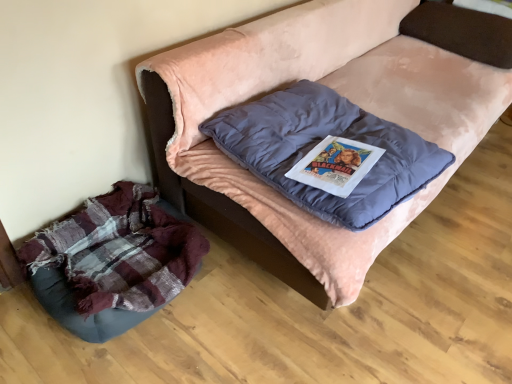
Image resolution: width=512 pixels, height=384 pixels. Describe the element at coordinates (462, 31) in the screenshot. I see `velvet blue pillow at upper right, the 1th pillow when ordered from top to bottom` at that location.

Locate an element on the screen. plaid fabric dog bed at lower left is located at coordinates (113, 261).

Image resolution: width=512 pixels, height=384 pixels. Identify the location of velvet blue pillow at center, positioned as the first pillow in left-to-right order. (319, 142).

This screenshot has height=384, width=512. What are the coordinates of `velvet blue pillow at upper right, which ranks as the second pillow in front-to-back order` in the screenshot? It's located at (462, 31).

Is velvet blue pillow at upper right, the 2th pillow positioned from the bottom, in front of or behind velvet pink couch at center in the image?

velvet blue pillow at upper right, the 2th pillow positioned from the bottom, is behind velvet pink couch at center.

From the picture: From the image's perspective, relative to velvet pink couch at center, is velvet blue pillow at upper right, the 2th pillow positioned from the bottom, above or below?

Based on their image positions, velvet blue pillow at upper right, the 2th pillow positioned from the bottom, is located above velvet pink couch at center.

Considering the relative sizes of velvet blue pillow at upper right, the 1th pillow viewed from the back, and velvet pink couch at center in the image provided, is velvet blue pillow at upper right, the 1th pillow viewed from the back, wider than velvet pink couch at center?

In fact, velvet blue pillow at upper right, the 1th pillow viewed from the back, might be narrower than velvet pink couch at center.

Is velvet blue pillow at upper right, the 1th pillow when ordered from top to bottom, facing towards velvet pink couch at center?

Yes, velvet blue pillow at upper right, the 1th pillow when ordered from top to bottom, is facing velvet pink couch at center.

Looking at this image, is velvet pink couch at center turned away from plaid fabric dog bed at lower left?

No, velvet pink couch at center's orientation is not away from plaid fabric dog bed at lower left.

How different are the orientations of velvet pink couch at center and plaid fabric dog bed at lower left in degrees?

velvet pink couch at center and plaid fabric dog bed at lower left are facing 4.64e-05 degrees away from each other.

Is velvet pink couch at center touching plaid fabric dog bed at lower left?

velvet pink couch at center and plaid fabric dog bed at lower left are not in contact.

From the image's perspective, is velvet pink couch at center positioned above or below plaid fabric dog bed at lower left?

Based on their image positions, velvet pink couch at center is located above plaid fabric dog bed at lower left.

Does point (298, 83) come in front of point (426, 25)?

That is True.

Could you tell me if velvet blue pillow at center, which is the 2th pillow from top to bottom, is turned towards velvet blue pillow at upper right, the 1th pillow when ordered from top to bottom?

No, velvet blue pillow at center, which is the 2th pillow from top to bottom, is not oriented towards velvet blue pillow at upper right, the 1th pillow when ordered from top to bottom.

Locate an element on the screen. This screenshot has width=512, height=384. pillow lying on the left of velvet blue pillow at upper right, the 2th pillow positioned from the bottom is located at coordinates (319, 142).

Considering the sizes of objects velvet blue pillow at center, marked as the first pillow in a front-to-back arrangement, and velvet blue pillow at upper right, the 2th pillow positioned from the bottom, in the image provided, who is wider, velvet blue pillow at center, marked as the first pillow in a front-to-back arrangement, or velvet blue pillow at upper right, the 2th pillow positioned from the bottom,?

velvet blue pillow at center, marked as the first pillow in a front-to-back arrangement.

Is velvet pink couch at center in contact with velvet blue pillow at center, positioned as the first pillow in left-to-right order?

No, velvet pink couch at center is not touching velvet blue pillow at center, positioned as the first pillow in left-to-right order.

Between velvet pink couch at center and velvet blue pillow at center, positioned as the first pillow in left-to-right order, which one has less height?

velvet blue pillow at center, positioned as the first pillow in left-to-right order.

How distant is velvet pink couch at center from velvet blue pillow at center, which is the 2th pillow from top to bottom?

They are 11.67 inches apart.

Looking at this image, is velvet pink couch at center inside or outside of velvet blue pillow at center, which is the 2th pillow from top to bottom?

velvet pink couch at center is not inside velvet blue pillow at center, which is the 2th pillow from top to bottom, it's outside.

Is velvet blue pillow at center, which ranks as the second pillow in right-to-left order, behind plaid fabric dog bed at lower left?

No, velvet blue pillow at center, which ranks as the second pillow in right-to-left order, is in front of plaid fabric dog bed at lower left.

Is velvet blue pillow at center, marked as the first pillow in a front-to-back arrangement, looking in the opposite direction of plaid fabric dog bed at lower left?

velvet blue pillow at center, marked as the first pillow in a front-to-back arrangement, is not turned away from plaid fabric dog bed at lower left.

Measure the distance between velvet blue pillow at center, which appears as the 2th pillow when viewed from the back, and plaid fabric dog bed at lower left.

velvet blue pillow at center, which appears as the 2th pillow when viewed from the back, and plaid fabric dog bed at lower left are 22.51 inches apart.

There is a plaid fabric dog bed at lower left. Where is `the 1st pillow above it (from the image's perspective)`? Image resolution: width=512 pixels, height=384 pixels. the 1st pillow above it (from the image's perspective) is located at coordinates (319, 142).

How many degrees apart are the facing directions of plaid fabric dog bed at lower left and velvet pink couch at center?

4.64e-05 degrees.

From a real-world perspective, between plaid fabric dog bed at lower left and velvet pink couch at center, who is vertically higher?

In real-world perspective, velvet pink couch at center is above.

Between plaid fabric dog bed at lower left and velvet pink couch at center, which one has smaller size?

Smaller between the two is plaid fabric dog bed at lower left.

Is the surface of plaid fabric dog bed at lower left in direct contact with velvet pink couch at center?

No, plaid fabric dog bed at lower left is not with velvet pink couch at center.

Is plaid fabric dog bed at lower left taller than velvet blue pillow at upper right, the 1th pillow viewed from the back?

Correct, plaid fabric dog bed at lower left is much taller as velvet blue pillow at upper right, the 1th pillow viewed from the back.

Could you tell me if plaid fabric dog bed at lower left is facing velvet blue pillow at upper right, the 2th pillow positioned from the bottom?

No, plaid fabric dog bed at lower left is not oriented towards velvet blue pillow at upper right, the 2th pillow positioned from the bottom.

Is point (83, 224) farther from camera compared to point (455, 28)?

No, (83, 224) is closer to viewer.

From a real-world perspective, is plaid fabric dog bed at lower left above or below velvet blue pillow at upper right, the 1th pillow viewed from the back?

In terms of real-world spatial position, plaid fabric dog bed at lower left is below velvet blue pillow at upper right, the 1th pillow viewed from the back.

The height and width of the screenshot is (384, 512). Find the location of `furniture directly beneath the velvet blue pillow at upper right, the 2th pillow positioned from the bottom (from a real-world perspective)`. furniture directly beneath the velvet blue pillow at upper right, the 2th pillow positioned from the bottom (from a real-world perspective) is located at coordinates (342, 94).

Identify the location of furniture above the plaid fabric dog bed at lower left (from the image's perspective). This screenshot has width=512, height=384. (342, 94).

From the image, which object appears to be farther from velvet blue pillow at upper right, which ranks as the second pillow in front-to-back order, velvet blue pillow at center, marked as the first pillow in a front-to-back arrangement, or velvet pink couch at center?

velvet blue pillow at center, marked as the first pillow in a front-to-back arrangement, lies further to velvet blue pillow at upper right, which ranks as the second pillow in front-to-back order, than the other object.

Considering their positions, is velvet blue pillow at upper right, which appears as the 1th pillow when viewed from the right, positioned closer to velvet pink couch at center than plaid fabric dog bed at lower left?

velvet blue pillow at upper right, which appears as the 1th pillow when viewed from the right, is positioned closer to the anchor velvet pink couch at center.

Based on the photo, estimate the real-world distances between objects in this image. Which object is closer to velvet blue pillow at center, marked as the first pillow in a front-to-back arrangement, velvet blue pillow at upper right, which ranks as the second pillow in front-to-back order, or plaid fabric dog bed at lower left?

plaid fabric dog bed at lower left.

From the image, which object appears to be nearer to plaid fabric dog bed at lower left, velvet blue pillow at center, marked as the first pillow in a front-to-back arrangement, or velvet blue pillow at upper right, the 1th pillow when ordered from top to bottom?

velvet blue pillow at center, marked as the first pillow in a front-to-back arrangement, is positioned closer to the anchor plaid fabric dog bed at lower left.

Estimate the real-world distances between objects in this image. Which object is further from velvet blue pillow at center, marked as the first pillow in a front-to-back arrangement, velvet pink couch at center or plaid fabric dog bed at lower left?

Among the two, plaid fabric dog bed at lower left is located further to velvet blue pillow at center, marked as the first pillow in a front-to-back arrangement.

Which object lies nearer to the anchor point plaid fabric dog bed at lower left, velvet blue pillow at center, marked as the first pillow in a front-to-back arrangement, or velvet pink couch at center?

Result: velvet blue pillow at center, marked as the first pillow in a front-to-back arrangement, is positioned closer to the anchor plaid fabric dog bed at lower left.

Which object lies further to the anchor point velvet blue pillow at upper right, the 1th pillow when ordered from top to bottom, velvet blue pillow at center, positioned as the first pillow in bottom-to-top order, or plaid fabric dog bed at lower left?

plaid fabric dog bed at lower left lies further to velvet blue pillow at upper right, the 1th pillow when ordered from top to bottom, than the other object.

Considering their positions, is velvet pink couch at center positioned closer to velvet blue pillow at upper right, which is the second pillow in left-to-right order, than plaid fabric dog bed at lower left?

velvet pink couch at center is closer to velvet blue pillow at upper right, which is the second pillow in left-to-right order.

You are a GUI agent. You are given a task and a screenshot of the screen. Output one action in this format:
    pyautogui.click(x=<x>, y=<y>)
    Task: Click on the furniture between plaid fabric dog bed at lower left and velvet blue pillow at upper right, which ranks as the second pillow in front-to-back order, from left to right
    This screenshot has width=512, height=384.
    Given the screenshot: What is the action you would take?
    pyautogui.click(x=342, y=94)

Locate an element on the screen. Image resolution: width=512 pixels, height=384 pixels. pillow between plaid fabric dog bed at lower left and velvet pink couch at center from left to right is located at coordinates (319, 142).

Identify the location of pillow between plaid fabric dog bed at lower left and velvet blue pillow at upper right, which is the second pillow in left-to-right order, from left to right. Image resolution: width=512 pixels, height=384 pixels. (319, 142).

Locate an element on the screen. pillow between velvet pink couch at center and velvet blue pillow at upper right, which is the second pillow in left-to-right order, along the z-axis is located at coordinates (319, 142).